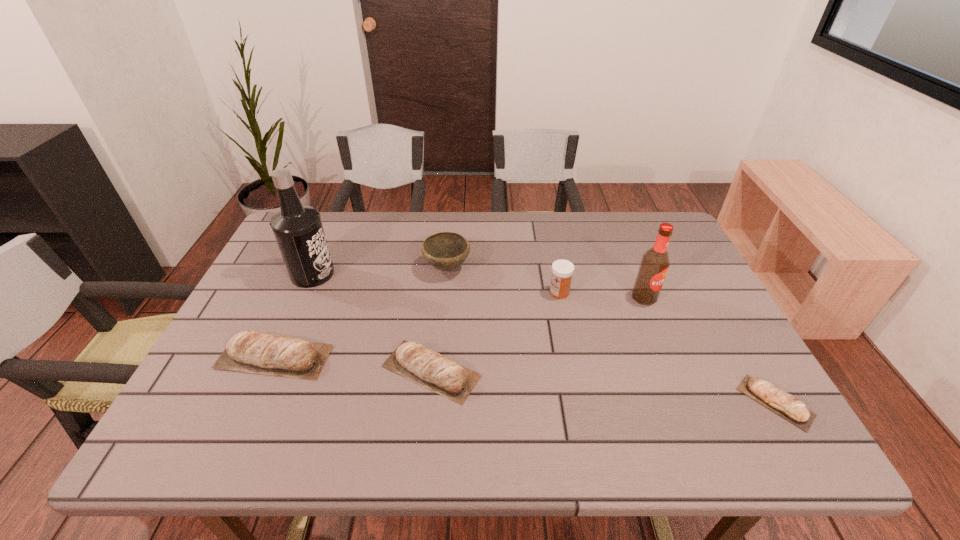
This screenshot has height=540, width=960. Find the location of `the leftmost pita bread`. the leftmost pita bread is located at coordinates (270, 355).

The height and width of the screenshot is (540, 960). In order to click on the second pita bread from right to left in this screenshot , I will do `click(412, 360)`.

Identify the location of the second tallest pita bread. Image resolution: width=960 pixels, height=540 pixels. (412, 360).

You are a GUI agent. You are given a task and a screenshot of the screen. Output one action in this format:
    pyautogui.click(x=<x>, y=<y>)
    Task: Click on the shortest pita bread
    Image resolution: width=960 pixels, height=540 pixels.
    Given the screenshot: What is the action you would take?
    pyautogui.click(x=789, y=407)

Find the location of a particular element. This screenshot has width=960, height=540. the rightmost pita bread is located at coordinates (789, 407).

This screenshot has height=540, width=960. I want to click on bowl, so click(x=446, y=251).

You are a GUI agent. You are given a task and a screenshot of the screen. Output one action in this format:
    pyautogui.click(x=<x>, y=<y>)
    Task: Click on the tallest object
    
    Given the screenshot: What is the action you would take?
    pyautogui.click(x=298, y=230)

The width and height of the screenshot is (960, 540). I want to click on the fifth object from left to right, so click(x=562, y=270).

This screenshot has height=540, width=960. Identify the location of beer bottle. (654, 265).

The height and width of the screenshot is (540, 960). In order to click on the second object from right to left in this screenshot , I will do `click(654, 265)`.